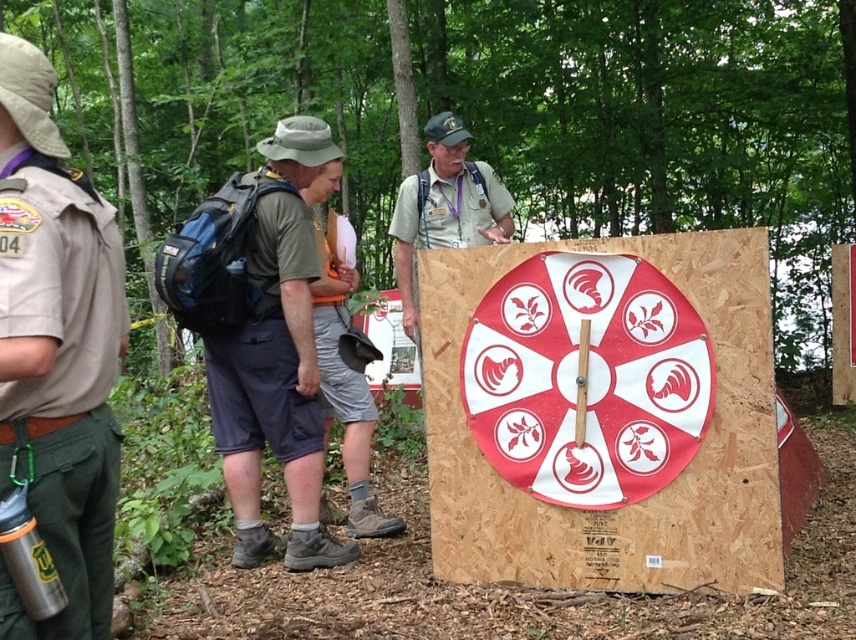
Is point (156, 152) farther from viewer compared to point (453, 129)?

Yes, it is behind point (453, 129).

Is wooden dartboard at center positioned at the back of khaki uniform at center?

Yes, wooden dartboard at center is further from the viewer.

Identify the location of wooden dartboard at center. (658, 124).

Can you confirm if red matte dartboard at center is shorter than dark green fabric shirt at center?

Yes, red matte dartboard at center is shorter than dark green fabric shirt at center.

Who is more forward, (421, 273) or (221, 413)?

Positioned in front is point (421, 273).

Image resolution: width=856 pixels, height=640 pixels. I want to click on red matte dartboard at center, so click(x=603, y=412).

Does wooden dartboard at center appear on the right side of red matte dartboard at center?

Correct, you'll find wooden dartboard at center to the right of red matte dartboard at center.

Which is in front, point (22, 17) or point (733, 554)?

Point (733, 554) is in front.

In order to click on wooden dartboard at center in this screenshot , I will do `click(658, 124)`.